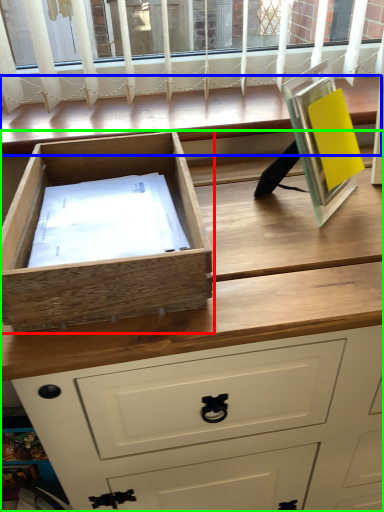
Question: Estimate the real-world distances between objects in this image. Which object is farther from drawer (highlighted by a red box), window (highlighted by a blue box) or chest of drawers (highlighted by a green box)?

Choices:
 (A) window
 (B) chest of drawers

Answer: (A)